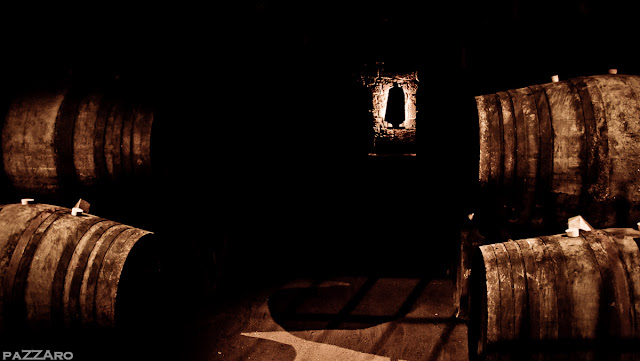
Find the location of a particular element. wodden floor is located at coordinates (390, 304).